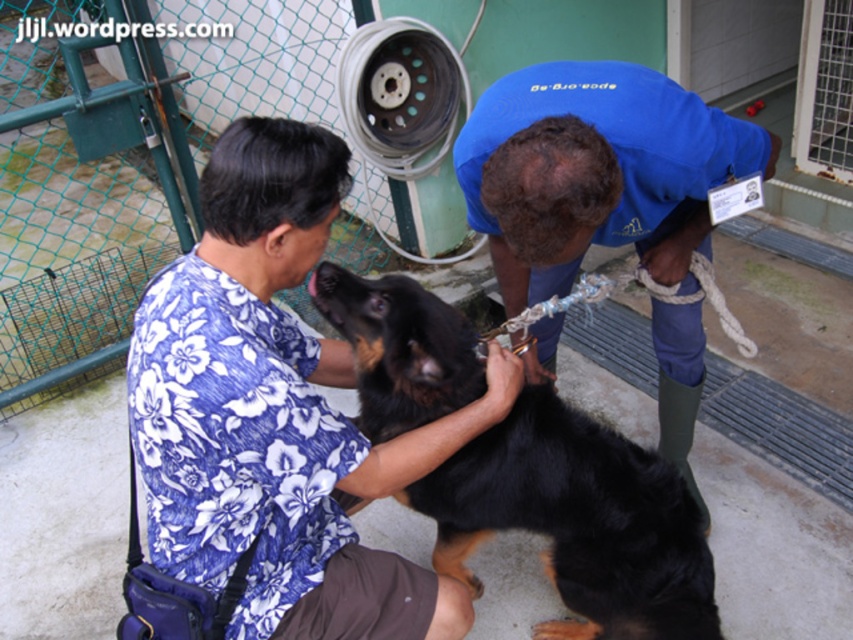
Question: Where is black fur dog at center located in relation to blue fabric shirt at center in the image?

Choices:
 (A) below
 (B) above

Answer: (A)

Question: Among these objects, which one is farthest from the camera?

Choices:
 (A) blue fabric shirt at center
 (B) black fur dog at center
 (C) floral fabric shirt at lower left

Answer: (B)

Question: Does floral fabric shirt at lower left have a smaller size compared to blue fabric shirt at center?

Choices:
 (A) yes
 (B) no

Answer: (A)

Question: Observing the image, what is the correct spatial positioning of floral fabric shirt at lower left in reference to blue fabric shirt at center?

Choices:
 (A) right
 (B) left

Answer: (B)

Question: Which object is positioned farthest from the blue fabric shirt at center?

Choices:
 (A) black fur dog at center
 (B) floral fabric shirt at lower left

Answer: (B)

Question: Based on their relative distances, which object is farther from the blue fabric shirt at center?

Choices:
 (A) floral fabric shirt at lower left
 (B) black fur dog at center

Answer: (A)